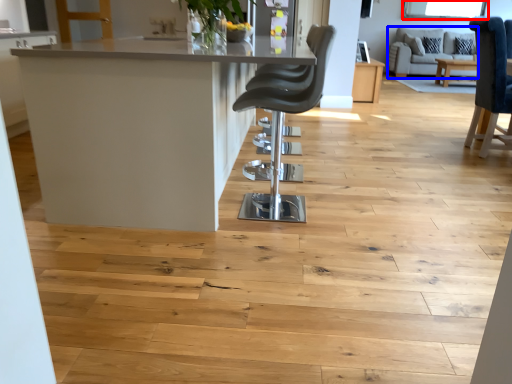
Question: Which object is closer to the camera taking this photo, window screen (highlighted by a red box) or couch (highlighted by a blue box)?

Choices:
 (A) window screen
 (B) couch

Answer: (B)